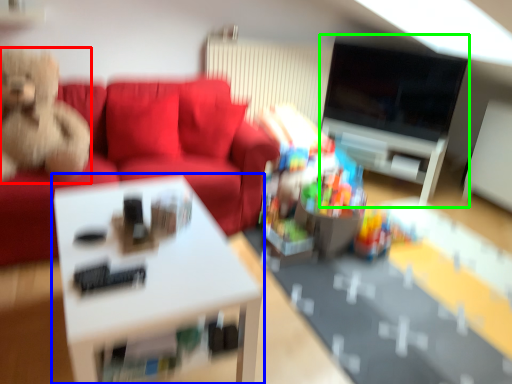
Question: Which object is positioned closest to toy (highlighted by a red box)? Select from table (highlighted by a blue box) and entertainment center (highlighted by a green box).

Choices:
 (A) table
 (B) entertainment center

Answer: (A)